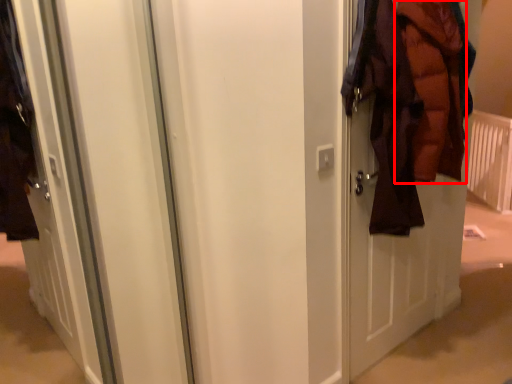
Question: From the image's perspective, what is the correct spatial positioning of garment (annotated by the red box) in reference to radiator?

Choices:
 (A) above
 (B) below

Answer: (B)